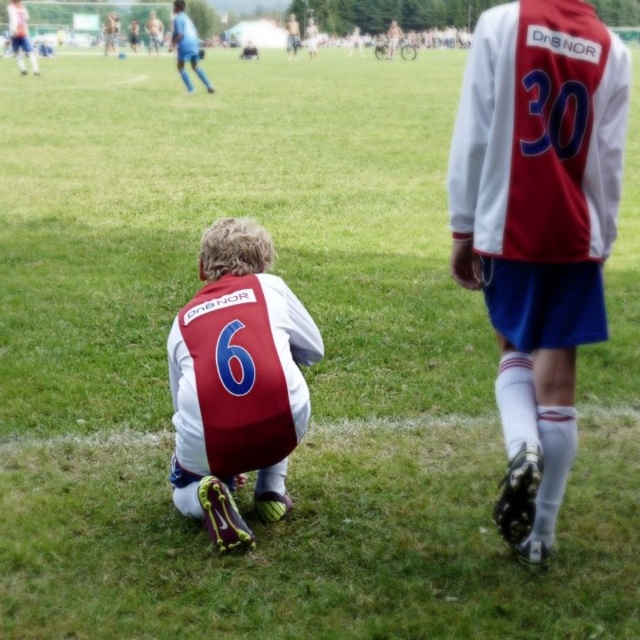
Consider the image. You are a referee in the soccer match and need to locate the matte white jersey at center and the matte blue shorts at upper left. Which one is positioned to the right side of the other?

The matte white jersey at center is to the right of matte blue shorts at upper left.

You are a soccer player positioned at the point with coordinates point (13, 24). You need to pass the ball to your teammate located at point (211, 92). Considering the positions of the two points, will your pass travel forward or backward relative to your current facing direction?

The point (211, 92) is in front of point (13, 24), so the pass will travel forward relative to your current facing direction.

You are a soccer coach analyzing the field. You notice a point marked at coordinates (186, 45). What object is located at this position?

The point at coordinates (186, 45) indicates blue fabric shorts at upper left.